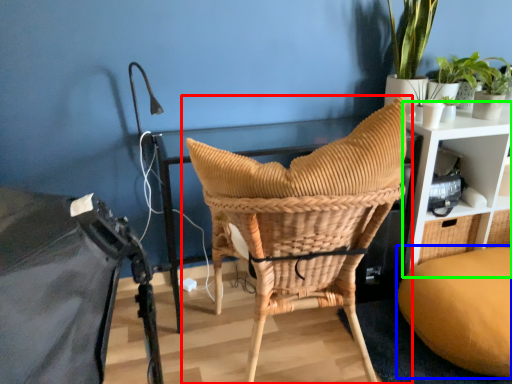
Question: Which object is the closest to the chair (highlighted by a red box)? Choose among these: bean bag chair (highlighted by a blue box) or shelf (highlighted by a green box).

Choices:
 (A) bean bag chair
 (B) shelf

Answer: (A)